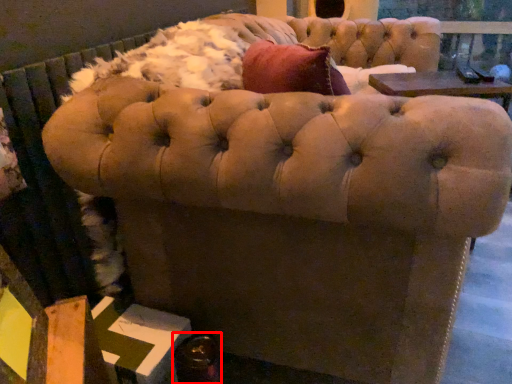
Question: From the image, what is the correct spatial relationship of bottle (annotated by the red box) in relation to furniture?

Choices:
 (A) right
 (B) left

Answer: (B)